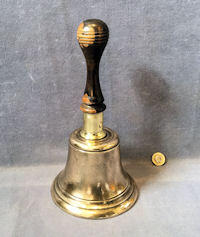
The width and height of the screenshot is (200, 237). Find the location of `wall`. wall is located at coordinates (37, 50).